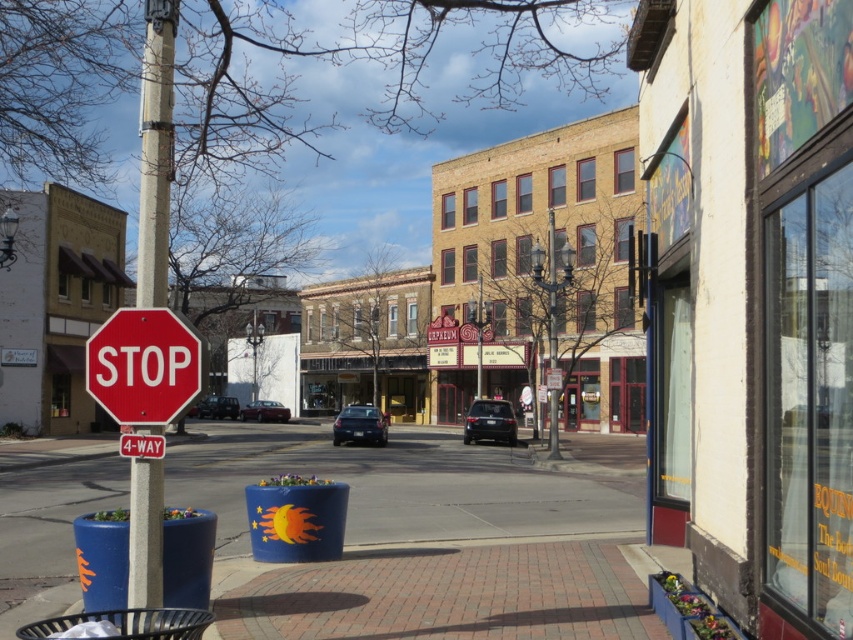
Question: Is red matte stop sign at left wider than red plastic stop sign at center?

Choices:
 (A) yes
 (B) no

Answer: (A)

Question: Which object appears farthest from the camera in this image?

Choices:
 (A) gray concrete pole at left
 (B) red matte stop sign at left
 (C) red plastic stop sign at center

Answer: (C)

Question: Is gray concrete pole at left positioned behind red matte stop sign at left?

Choices:
 (A) yes
 (B) no

Answer: (B)

Question: Which point is closer to the camera?

Choices:
 (A) (128, 442)
 (B) (138, 340)
 (C) (149, 282)

Answer: (B)

Question: Which of the following is the farthest from the observer?

Choices:
 (A) 141,448
 (B) 204,380

Answer: (A)

Question: Does gray concrete pole at left have a lesser width compared to red plastic stop sign at center?

Choices:
 (A) no
 (B) yes

Answer: (A)